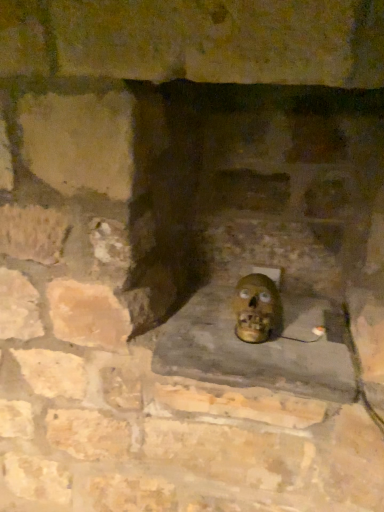
Find the location of a particular element. This screenshot has height=512, width=384. free location to the right of gold metallic skull at center is located at coordinates (315, 335).